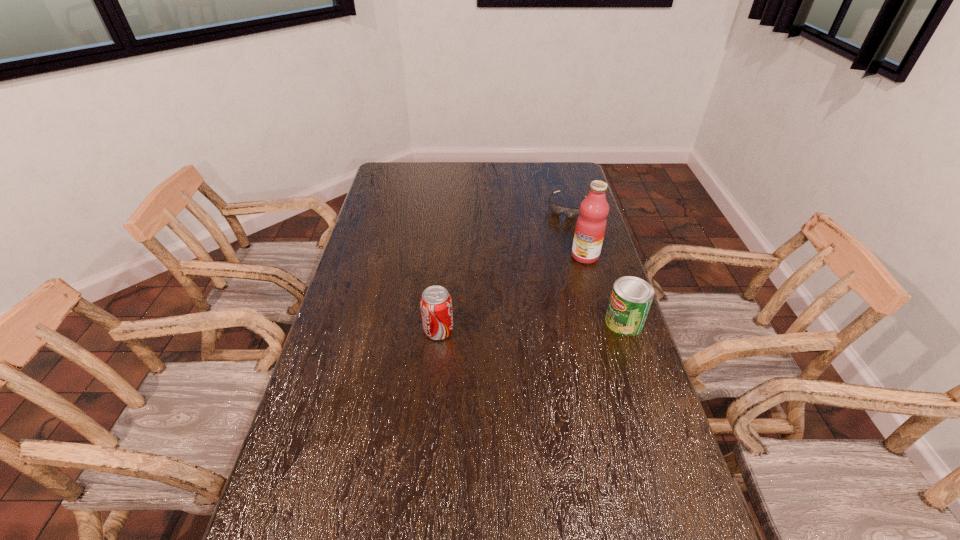
Identify the location of free space on the desktop that is between the leftmost object and the can and is positioned on the lenses of the farthest object. Image resolution: width=960 pixels, height=540 pixels. (507, 328).

Find the location of a particular element. Image resolution: width=960 pixels, height=540 pixels. vacant space on the desktop that is between the soda and the can and is positioned on the label of the tallest object is located at coordinates (514, 328).